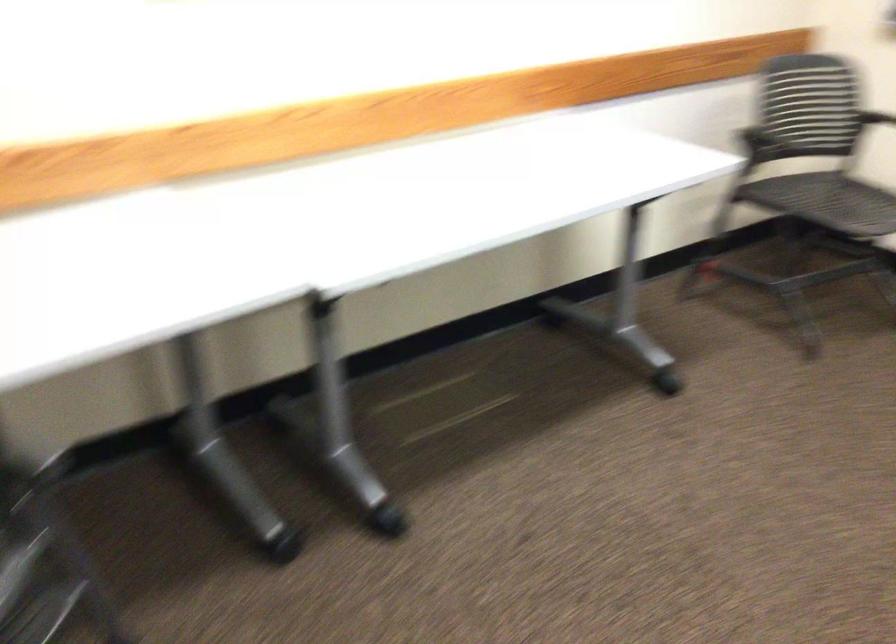
Locate an element on the screen. The height and width of the screenshot is (644, 896). black chair armrest is located at coordinates (874, 118).